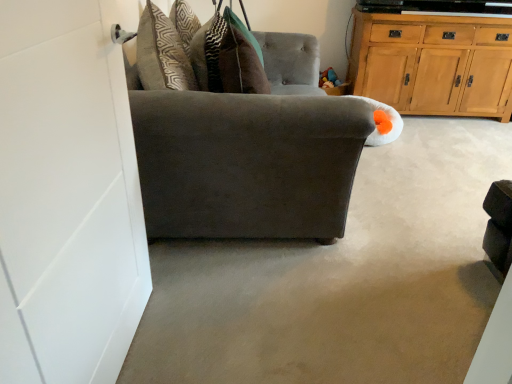
Question: From the image's perspective, is wooden cabinet at upper right located above dark gray fabric couch at center?

Choices:
 (A) no
 (B) yes

Answer: (B)

Question: Is wooden cabinet at upper right smaller than dark gray fabric couch at center?

Choices:
 (A) yes
 (B) no

Answer: (B)

Question: Could dark gray fabric couch at center be considered to be inside wooden cabinet at upper right?

Choices:
 (A) yes
 (B) no

Answer: (B)

Question: From the image's perspective, is wooden cabinet at upper right under dark gray fabric couch at center?

Choices:
 (A) yes
 (B) no

Answer: (B)

Question: Does wooden cabinet at upper right touch dark gray fabric couch at center?

Choices:
 (A) yes
 (B) no

Answer: (B)

Question: From the image's perspective, is wooden cabinet at upper right located above or below dark gray fabric couch at center?

Choices:
 (A) below
 (B) above

Answer: (B)

Question: From a real-world perspective, relative to dark gray fabric couch at center, is wooden cabinet at upper right vertically above or below?

Choices:
 (A) below
 (B) above

Answer: (B)

Question: Is wooden cabinet at upper right taller or shorter than dark gray fabric couch at center?

Choices:
 (A) short
 (B) tall

Answer: (B)

Question: Looking at their shapes, would you say wooden cabinet at upper right is wider or thinner than dark gray fabric couch at center?

Choices:
 (A) wide
 (B) thin

Answer: (B)

Question: From a real-world perspective, is dark gray fabric couch at center positioned above or below suede gray chair at left?

Choices:
 (A) above
 (B) below

Answer: (B)

Question: Is dark gray fabric couch at center situated inside suede gray chair at left or outside?

Choices:
 (A) outside
 (B) inside

Answer: (A)

Question: Based on their sizes in the image, would you say dark gray fabric couch at center is bigger or smaller than suede gray chair at left?

Choices:
 (A) small
 (B) big

Answer: (A)

Question: Considering the relative positions of dark gray fabric couch at center and suede gray chair at left in the image provided, is dark gray fabric couch at center to the left or to the right of suede gray chair at left?

Choices:
 (A) left
 (B) right

Answer: (B)

Question: Considering the positions of suede gray chair at left and wooden cabinet at upper right in the image, is suede gray chair at left taller or shorter than wooden cabinet at upper right?

Choices:
 (A) short
 (B) tall

Answer: (A)

Question: Is point click(239, 155) positioned closer to the camera than point click(387, 87)?

Choices:
 (A) farther
 (B) closer

Answer: (B)